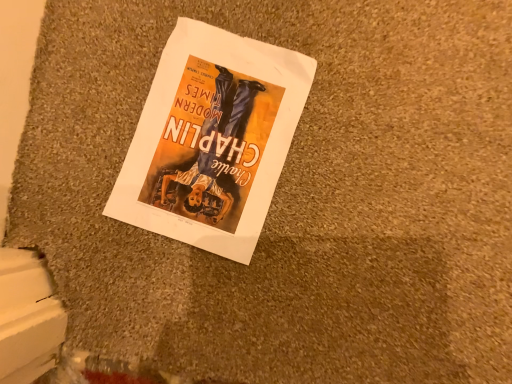
Question: Should I look upward or downward to see matte paper poster at center?

Choices:
 (A) down
 (B) up

Answer: (B)